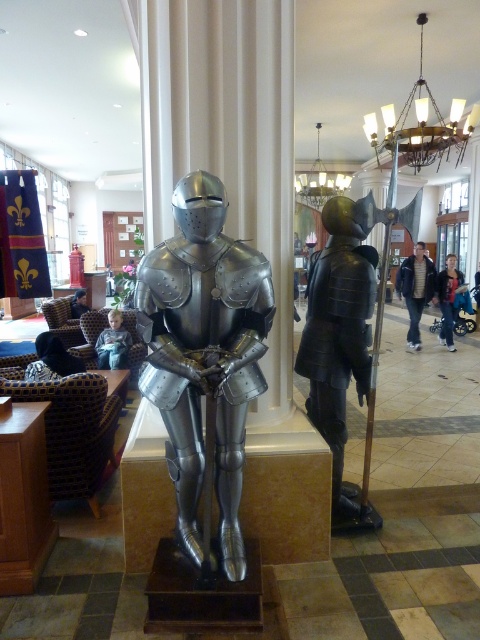
Is gold metallic chandelier at upper center above dark blue jacket at center?

Correct, gold metallic chandelier at upper center is located above dark blue jacket at center.

The image size is (480, 640). I want to click on gold metallic chandelier at upper center, so click(420, 125).

Who is more forward, (371, 131) or (420, 314)?

Point (371, 131) is more forward.

Locate an element on the screen. The image size is (480, 640). gold metallic chandelier at upper center is located at coordinates (420, 125).

Is shiny black armor at center shorter than gold metallic chandelier at upper center?

No, shiny black armor at center is not shorter than gold metallic chandelier at upper center.

Is point (333, 424) closer to viewer compared to point (397, 163)?

Yes.

Where is `shiny black armor at center`? The height and width of the screenshot is (640, 480). shiny black armor at center is located at coordinates (339, 346).

The image size is (480, 640). What do you see at coordinates (420, 125) in the screenshot?
I see `gold metallic chandelier at upper center` at bounding box center [420, 125].

Can you confirm if gold metallic chandelier at upper center is positioned below dark blue jeans at center?

Incorrect, gold metallic chandelier at upper center is not positioned below dark blue jeans at center.

What do you see at coordinates (420, 125) in the screenshot? This screenshot has width=480, height=640. I see `gold metallic chandelier at upper center` at bounding box center [420, 125].

Where is `gold metallic chandelier at upper center`? This screenshot has width=480, height=640. gold metallic chandelier at upper center is located at coordinates point(420,125).